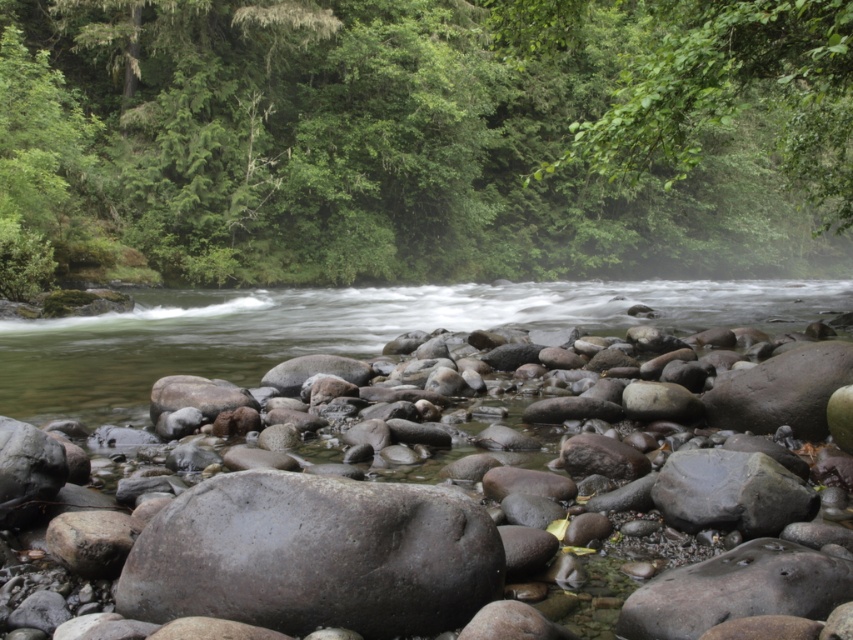
You are standing at point (519, 426) and want to reach the riverbank. Is the point (715, 234) located behind you or in front of you as you face the river?

Point (715, 234) is behind point (519, 426), so it is located behind you as you face the river.

You are standing at the center of the rocks in the foreground of the scene. Which direction should you walk to reach the green leafy tree at upper center?

The green leafy tree at upper center is located at point (422, 138), so you should walk towards the upper center direction to reach it.